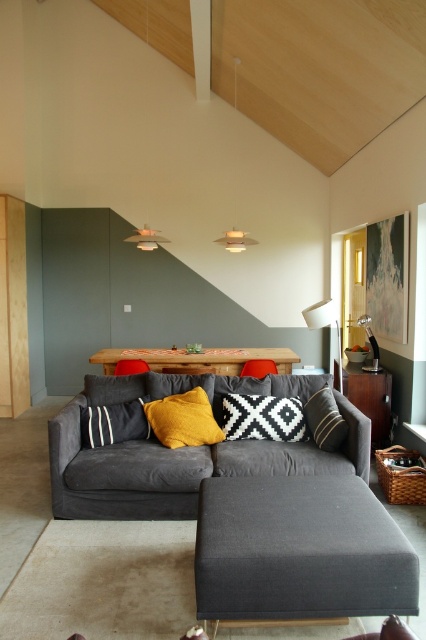
Which of these two, black woven pillow at center or yellow fabric pillow at center, stands shorter?

black woven pillow at center is shorter.

Between black woven pillow at center and yellow fabric pillow at center, which one is positioned higher?

yellow fabric pillow at center is above.

Measure the distance between black woven pillow at center and camera.

3.75 meters

The height and width of the screenshot is (640, 426). Identify the location of black woven pillow at center. (262, 417).

Does point (290, 540) lie behind point (264, 422)?

No.

Who is more distant from viewer, (x=253, y=577) or (x=285, y=401)?

Point (x=285, y=401)

Find the location of a particular element. The height and width of the screenshot is (640, 426). matte fabric ottoman at center is located at coordinates (299, 550).

Looking at this image, which is more to the left, matte fabric ottoman at center or yellow fabric pillow at center?

yellow fabric pillow at center is more to the left.

Between point (232, 524) and point (206, 404), which one is positioned in front?

Point (232, 524)

Is point (212, 579) behind point (170, 420)?

No.

Where is `matte fabric ottoman at center`? The width and height of the screenshot is (426, 640). matte fabric ottoman at center is located at coordinates (299, 550).